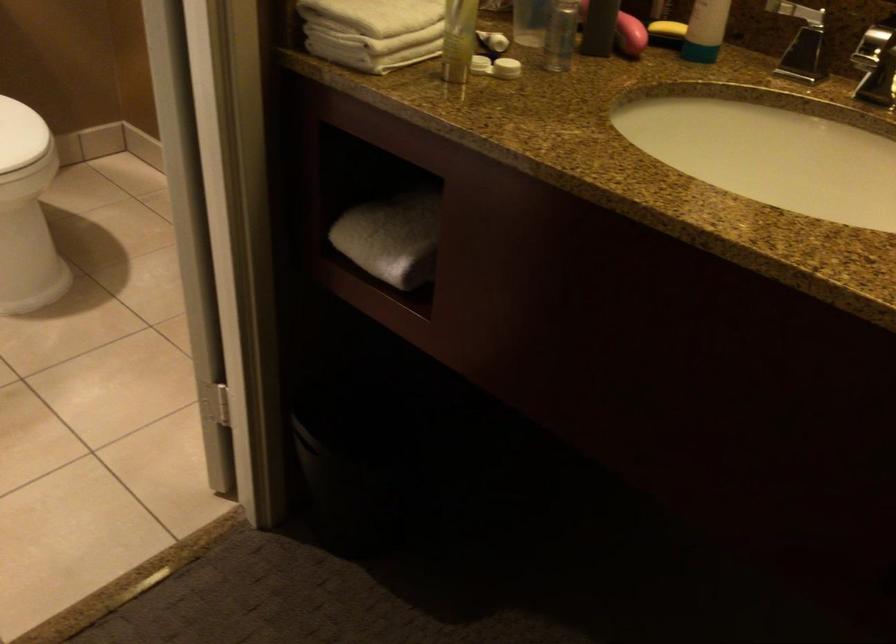
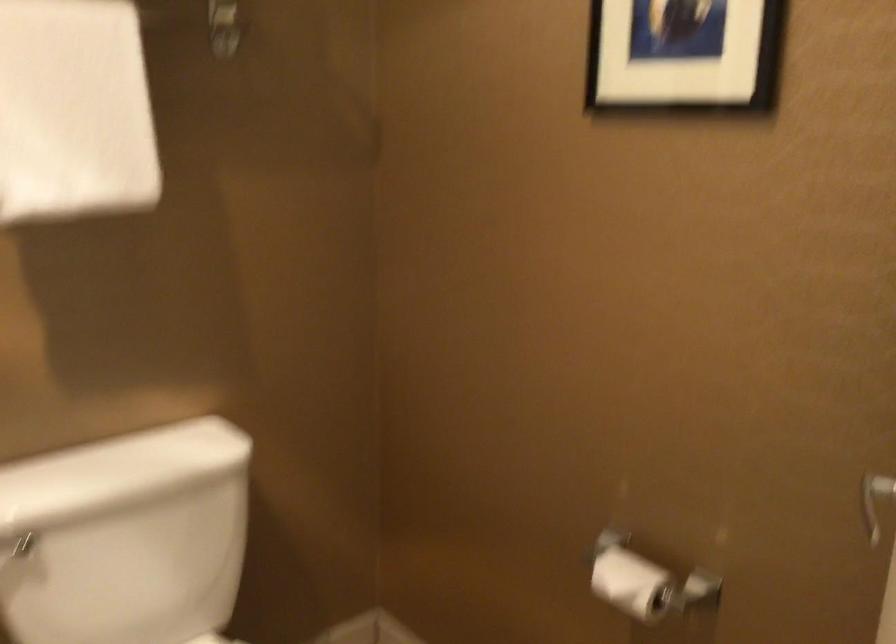
Question: The first image is from the beginning of the video and the second image is from the end. How did the camera likely rotate when shooting the video?

Choices:
 (A) Left
 (B) Right
 (C) Up
 (D) Down

Answer: (C)